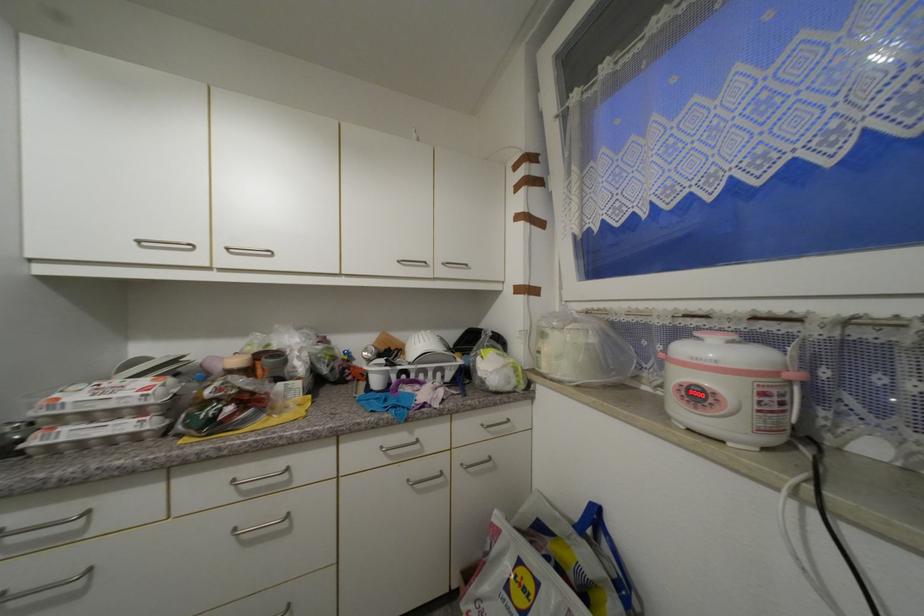
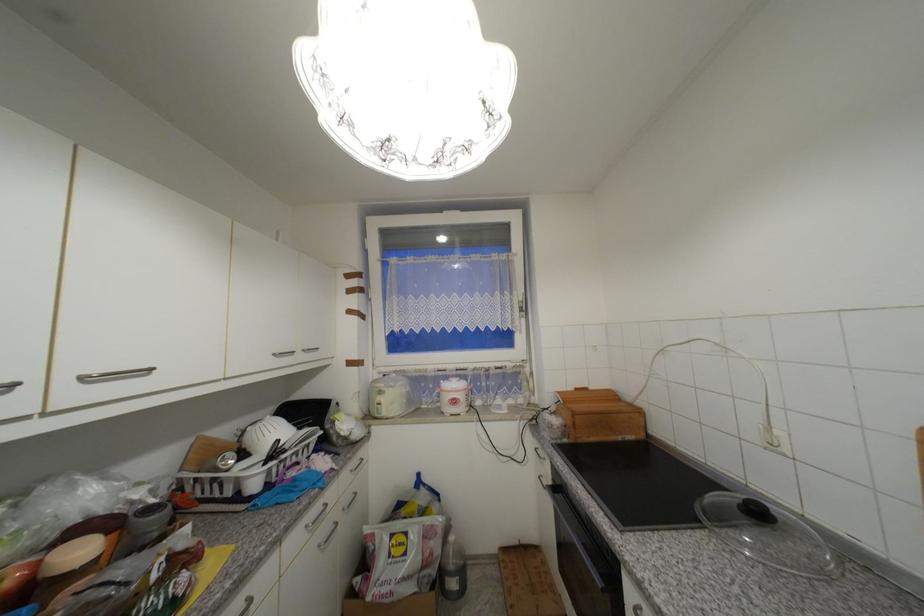
Locate, in the second image, the point that corresponds to pixel 701 398 in the first image.

(459, 403)